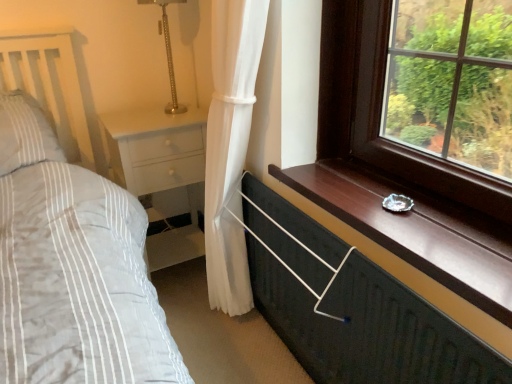
Identify the location of metallic dark green chest of drawers at lower right. Image resolution: width=512 pixels, height=384 pixels. (351, 307).

Locate an element on the screen. The width and height of the screenshot is (512, 384). metallic dark green chest of drawers at lower right is located at coordinates (351, 307).

From the image's perspective, is gold textured table lamp at upper center below white glossy nightstand at lower left?

No, from the image's perspective, gold textured table lamp at upper center is not beneath white glossy nightstand at lower left.

From a real-world perspective, is gold textured table lamp at upper center located beneath white glossy nightstand at lower left?

No, from a real-world perspective, gold textured table lamp at upper center is not below white glossy nightstand at lower left.

Does point (177, 102) come in front of point (154, 171)?

No.

Could you tell me if gold textured table lamp at upper center is facing white glossy nightstand at lower left?

No, gold textured table lamp at upper center is not facing towards white glossy nightstand at lower left.

Which object is further away from the camera, white glossy nightstand at lower left or gold textured table lamp at upper center?

white glossy nightstand at lower left is more distant.

Where is `table lamp above the white glossy nightstand at lower left (from a real-world perspective)`? Image resolution: width=512 pixels, height=384 pixels. table lamp above the white glossy nightstand at lower left (from a real-world perspective) is located at coordinates (168, 53).

From the image's perspective, would you say white glossy nightstand at lower left is positioned over gold textured table lamp at upper center?

Actually, white glossy nightstand at lower left appears below gold textured table lamp at upper center in the image.

Between white glossy nightstand at lower left and gold textured table lamp at upper center, which one has more height?

With more height is white glossy nightstand at lower left.

Would you say metallic dark green chest of drawers at lower right is a long distance from gold textured table lamp at upper center?

Absolutely, metallic dark green chest of drawers at lower right is distant from gold textured table lamp at upper center.

Consider the image. Considering their positions, is metallic dark green chest of drawers at lower right located in front of or behind gold textured table lamp at upper center?

In the image, metallic dark green chest of drawers at lower right appears in front of gold textured table lamp at upper center.

Find the location of `the chest of drawers in front of the gold textured table lamp at upper center`. the chest of drawers in front of the gold textured table lamp at upper center is located at coordinates (351, 307).

Between metallic dark green chest of drawers at lower right and gold textured table lamp at upper center, which one has larger width?

gold textured table lamp at upper center.

Based on the photo, is the position of metallic dark green chest of drawers at lower right less distant than that of white glossy nightstand at lower left?

Yes, metallic dark green chest of drawers at lower right is closer to the camera.

Is metallic dark green chest of drawers at lower right shorter than white glossy nightstand at lower left?

Yes, metallic dark green chest of drawers at lower right is shorter than white glossy nightstand at lower left.

Image resolution: width=512 pixels, height=384 pixels. What are the coordinates of `chest of drawers in front of the white glossy nightstand at lower left` in the screenshot? It's located at (351, 307).

Is the depth of white glossy nightstand at lower left less than that of metallic dark green chest of drawers at lower right?

No.

Does white glossy nightstand at lower left have a larger size compared to metallic dark green chest of drawers at lower right?

Correct, white glossy nightstand at lower left is larger in size than metallic dark green chest of drawers at lower right.

Which of these two, white glossy nightstand at lower left or metallic dark green chest of drawers at lower right, stands shorter?

metallic dark green chest of drawers at lower right is shorter.

Would you say white glossy nightstand at lower left contains metallic dark green chest of drawers at lower right?

No, metallic dark green chest of drawers at lower right is not inside white glossy nightstand at lower left.

Looking at this image, is gold textured table lamp at upper center further to camera compared to metallic dark green chest of drawers at lower right?

That is True.

Where is `chest of drawers on the right of the gold textured table lamp at upper center`? chest of drawers on the right of the gold textured table lamp at upper center is located at coordinates (351, 307).

Consider the image. Which object is thinner, gold textured table lamp at upper center or metallic dark green chest of drawers at lower right?

Thinner between the two is metallic dark green chest of drawers at lower right.

Locate an element on the screen. nightstand that is on the left side of gold textured table lamp at upper center is located at coordinates (156, 150).

There is a white glossy nightstand at lower left. Where is `table lamp above it (from a real-world perspective)`? The width and height of the screenshot is (512, 384). table lamp above it (from a real-world perspective) is located at coordinates (168, 53).

Based on their spatial positions, is white glossy nightstand at lower left or metallic dark green chest of drawers at lower right closer to gold textured table lamp at upper center?

white glossy nightstand at lower left is closer to gold textured table lamp at upper center.

Estimate the real-world distances between objects in this image. Which object is further from white glossy nightstand at lower left, metallic dark green chest of drawers at lower right or gold textured table lamp at upper center?

metallic dark green chest of drawers at lower right is further to white glossy nightstand at lower left.

From the picture: Considering their positions, is white glossy nightstand at lower left positioned further to metallic dark green chest of drawers at lower right than gold textured table lamp at upper center?

Based on the image, gold textured table lamp at upper center appears to be further to metallic dark green chest of drawers at lower right.

Looking at the image, which one is located closer to metallic dark green chest of drawers at lower right, gold textured table lamp at upper center or white glossy nightstand at lower left?

Based on the image, white glossy nightstand at lower left appears to be nearer to metallic dark green chest of drawers at lower right.

Based on their spatial positions, is metallic dark green chest of drawers at lower right or white glossy nightstand at lower left further from gold textured table lamp at upper center?

metallic dark green chest of drawers at lower right is further to gold textured table lamp at upper center.

Estimate the real-world distances between objects in this image. Which object is closer to white glossy nightstand at lower left, gold textured table lamp at upper center or metallic dark green chest of drawers at lower right?

Among the two, gold textured table lamp at upper center is located nearer to white glossy nightstand at lower left.

In order to click on table lamp between metallic dark green chest of drawers at lower right and white glossy nightstand at lower left in the front-back direction in this screenshot , I will do `click(168, 53)`.